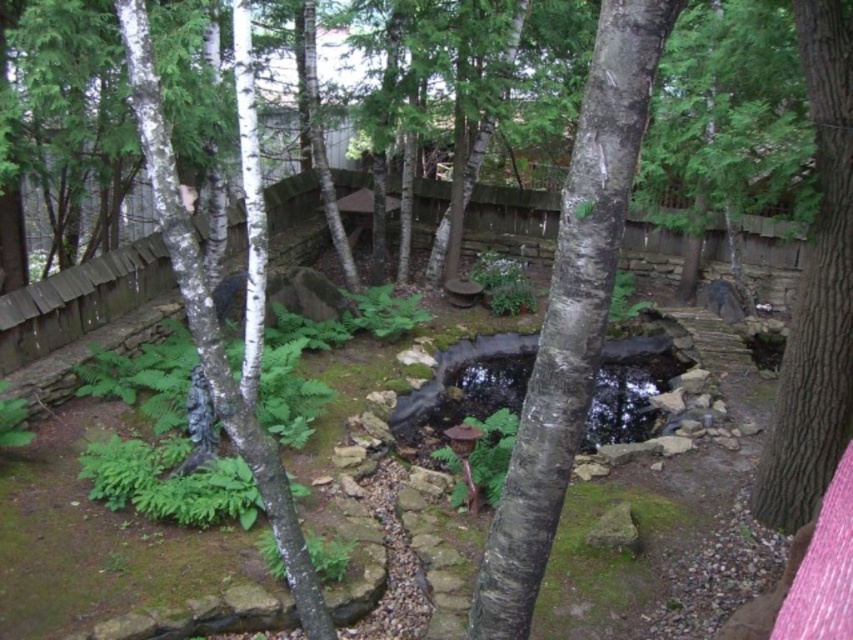
Which is below, brown rough bark tree trunk at right or white smooth tree at center?

white smooth tree at center is lower down.

Is brown rough bark tree trunk at right taller than white smooth tree at center?

Yes, brown rough bark tree trunk at right is taller than white smooth tree at center.

You are a GUI agent. You are given a task and a screenshot of the screen. Output one action in this format:
    pyautogui.click(x=<x>, y=<y>)
    Task: Click on the brown rough bark tree trunk at right
    This screenshot has width=853, height=640.
    Given the screenshot: What is the action you would take?
    pyautogui.click(x=816, y=291)

Identify the location of brown rough bark tree trunk at right. (816, 291).

The image size is (853, 640). What do you see at coordinates (572, 314) in the screenshot? I see `white smooth tree trunk at center` at bounding box center [572, 314].

This screenshot has height=640, width=853. I want to click on white smooth tree trunk at center, so click(x=572, y=314).

How much distance is there between white smooth tree trunk at center and white smooth tree at center?

The distance of white smooth tree trunk at center from white smooth tree at center is 4.18 feet.

Is point (634, 49) in front of point (172, 216)?

That is True.

This screenshot has width=853, height=640. I want to click on white smooth tree trunk at center, so click(572, 314).